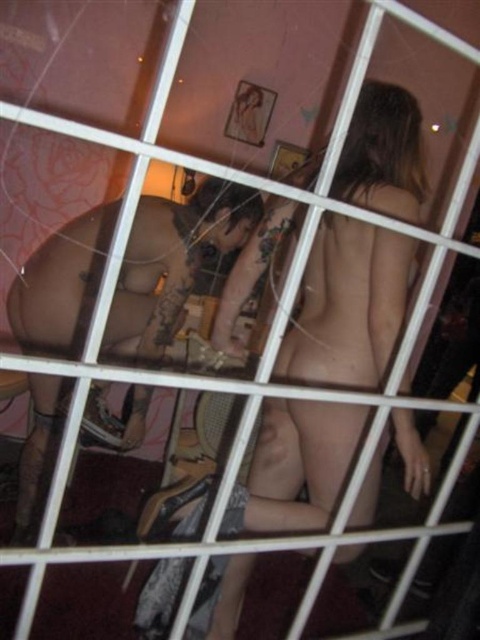
You are a photographer trying to capture a clear shot of the smooth skin man at center without the black matte underwear at lower center obstructing the view. Is this possible given their positions?

The black matte underwear at lower center is behind the smooth skin man at center, so it won not obstruct the view of the smooth skin man at center. You can capture a clear shot.

What are the coordinates of the smooth skin man at center?

The smooth skin man at center is located at coordinates point (x=173, y=259).

What is the significance of the point marked at coordinates (173,259) in the image?

The point marked at coordinates (173,259) indicates the location of the smooth skin man at center.